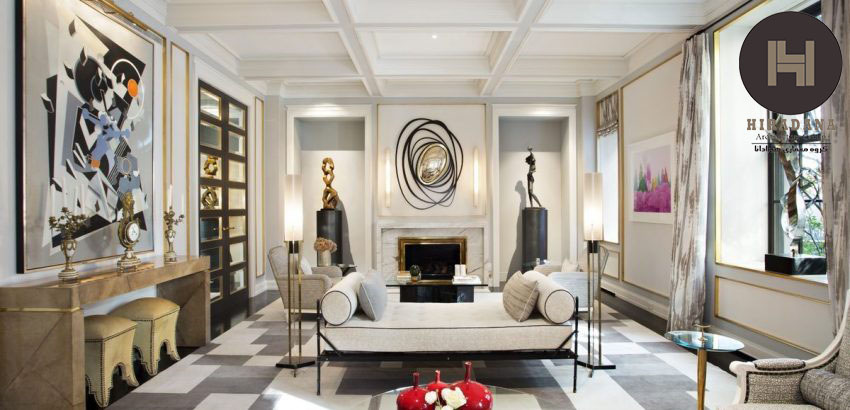
Where is `stools`? Image resolution: width=850 pixels, height=410 pixels. stools is located at coordinates (171, 309), (94, 346).